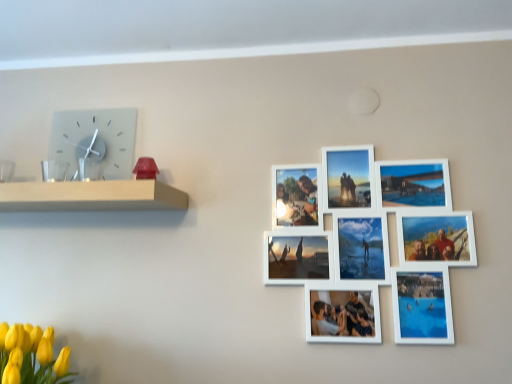
Question: Is yellow matte tulips at lower left shorter than white matte picture frame at upper right?

Choices:
 (A) yes
 (B) no

Answer: (A)

Question: Is yellow matte tulips at lower left aimed at white matte picture frame at upper right?

Choices:
 (A) no
 (B) yes

Answer: (A)

Question: Does yellow matte tulips at lower left come behind white matte picture frame at upper right?

Choices:
 (A) yes
 (B) no

Answer: (B)

Question: Is yellow matte tulips at lower left looking in the opposite direction of white matte picture frame at upper right?

Choices:
 (A) yes
 (B) no

Answer: (B)

Question: From the image's perspective, is yellow matte tulips at lower left beneath white matte picture frame at upper right?

Choices:
 (A) yes
 (B) no

Answer: (A)

Question: Is white matte picture frame at upper right taller or shorter than matte glass clock at upper left?

Choices:
 (A) short
 (B) tall

Answer: (B)

Question: Is point (309, 334) closer or farther from the camera than point (74, 129)?

Choices:
 (A) closer
 (B) farther

Answer: (A)

Question: Is white matte picture frame at upper right inside or outside of matte glass clock at upper left?

Choices:
 (A) outside
 (B) inside

Answer: (A)

Question: In terms of size, does white matte picture frame at upper right appear bigger or smaller than matte glass clock at upper left?

Choices:
 (A) big
 (B) small

Answer: (A)

Question: Considering the positions of point (182, 201) and point (46, 334), is point (182, 201) closer or farther from the camera than point (46, 334)?

Choices:
 (A) closer
 (B) farther

Answer: (B)

Question: Is white wooden shelf at left inside or outside of yellow matte tulips at lower left?

Choices:
 (A) inside
 (B) outside

Answer: (B)

Question: Is white wooden shelf at left bigger or smaller than yellow matte tulips at lower left?

Choices:
 (A) big
 (B) small

Answer: (B)

Question: Considering the relative positions of white wooden shelf at left and yellow matte tulips at lower left in the image provided, is white wooden shelf at left to the left or to the right of yellow matte tulips at lower left?

Choices:
 (A) left
 (B) right

Answer: (B)

Question: Based on their positions, is yellow matte tulips at lower left located to the left or right of matte glass clock at upper left?

Choices:
 (A) left
 (B) right

Answer: (A)

Question: From the image's perspective, is yellow matte tulips at lower left above or below matte glass clock at upper left?

Choices:
 (A) above
 (B) below

Answer: (B)